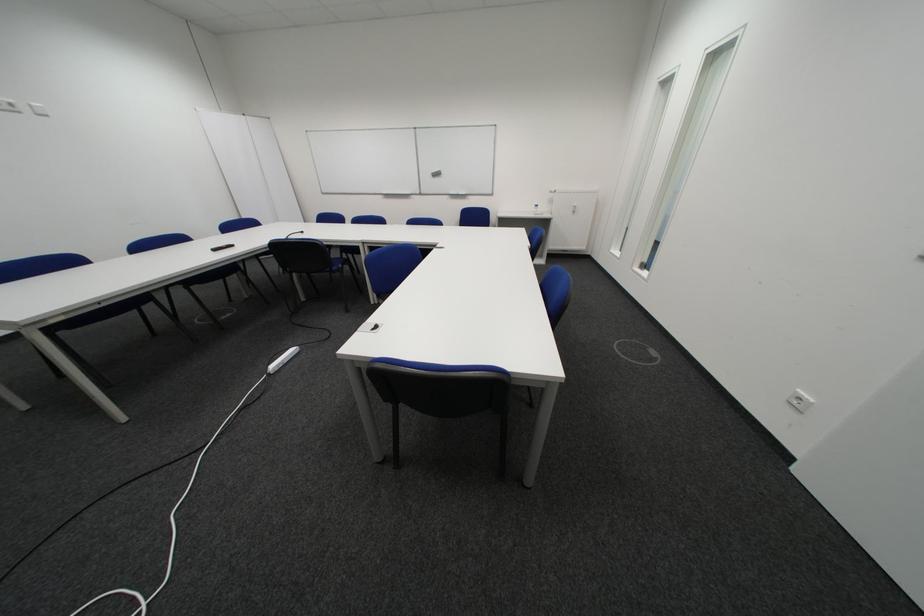
Find the location of a particular element. white power strip is located at coordinates (282, 360).